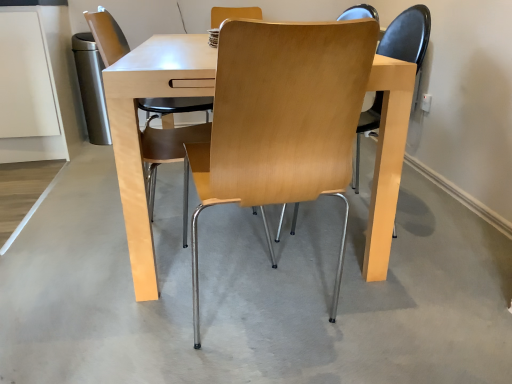
Question: Can you confirm if light wood/matte chair at center, the 2th chair viewed from the right, is wider than light gray concrete at center?

Choices:
 (A) yes
 (B) no

Answer: (B)

Question: From a real-world perspective, is light wood/matte chair at center, the 2th chair viewed from the right, physically below light gray concrete at center?

Choices:
 (A) no
 (B) yes

Answer: (A)

Question: Is light wood/matte chair at center, the 2th chair viewed from the right, next to light gray concrete at center?

Choices:
 (A) no
 (B) yes

Answer: (A)

Question: Would you consider light wood/matte chair at center, the 1th chair from the left, to be distant from light gray concrete at center?

Choices:
 (A) yes
 (B) no

Answer: (A)

Question: Is light wood/matte chair at center, the 2th chair viewed from the right, closer to the viewer compared to light gray concrete at center?

Choices:
 (A) yes
 (B) no

Answer: (B)

Question: Considering the positions of point (296, 311) and point (228, 54), is point (296, 311) closer or farther from the camera than point (228, 54)?

Choices:
 (A) closer
 (B) farther

Answer: (B)

Question: From the image's perspective, is light gray concrete at center above or below light wood/chrome chair at center, the 1th chair when ordered from right to left?

Choices:
 (A) below
 (B) above

Answer: (A)

Question: In the image, is light gray concrete at center on the left side or the right side of light wood/chrome chair at center, positioned as the 2th chair in left-to-right order?

Choices:
 (A) right
 (B) left

Answer: (B)

Question: Looking at their shapes, would you say light gray concrete at center is wider or thinner than light wood/chrome chair at center, positioned as the 2th chair in left-to-right order?

Choices:
 (A) thin
 (B) wide

Answer: (B)

Question: From a real-world perspective, relative to light wood/chrome chair at center, the 1th chair when ordered from right to left, is light wood/matte chair at center, the 1th chair from the left, vertically above or below?

Choices:
 (A) below
 (B) above

Answer: (B)

Question: Is light wood/matte chair at center, the 2th chair viewed from the right, in front of or behind light wood/chrome chair at center, the 1th chair when ordered from right to left, in the image?

Choices:
 (A) front
 (B) behind

Answer: (B)

Question: Looking at the image, does light wood/matte chair at center, the 1th chair from the left, seem bigger or smaller compared to light wood/chrome chair at center, the 1th chair when ordered from right to left?

Choices:
 (A) small
 (B) big

Answer: (A)

Question: Visually, is light wood/matte chair at center, the 1th chair from the left, positioned to the left or to the right of light wood/chrome chair at center, the 1th chair when ordered from right to left?

Choices:
 (A) left
 (B) right

Answer: (A)

Question: Considering the positions of light wood/chrome chair at center, the 1th chair when ordered from right to left, and light wood/matte chair at center, the 2th chair viewed from the right, in the image, is light wood/chrome chair at center, the 1th chair when ordered from right to left, bigger or smaller than light wood/matte chair at center, the 2th chair viewed from the right,?

Choices:
 (A) small
 (B) big

Answer: (B)

Question: Choose the correct answer: Is light wood/chrome chair at center, positioned as the 2th chair in left-to-right order, inside light wood/matte chair at center, the 1th chair from the left, or outside it?

Choices:
 (A) inside
 (B) outside

Answer: (B)